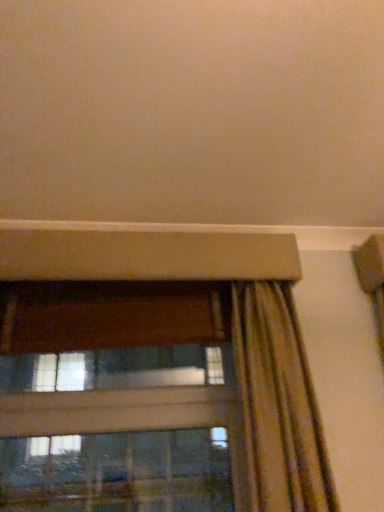
Question: From the image's perspective, is striped fabric curtain at lower right over transparent glass window at lower left?

Choices:
 (A) no
 (B) yes

Answer: (B)

Question: Is striped fabric curtain at lower right completely or partially outside of transparent glass window at lower left?

Choices:
 (A) yes
 (B) no

Answer: (A)

Question: Is striped fabric curtain at lower right oriented away from transparent glass window at lower left?

Choices:
 (A) no
 (B) yes

Answer: (A)

Question: Considering the relative sizes of striped fabric curtain at lower right and transparent glass window at lower left in the image provided, is striped fabric curtain at lower right wider than transparent glass window at lower left?

Choices:
 (A) no
 (B) yes

Answer: (B)

Question: From a real-world perspective, is striped fabric curtain at lower right below transparent glass window at lower left?

Choices:
 (A) yes
 (B) no

Answer: (B)

Question: Could you tell me if striped fabric curtain at lower right is facing transparent glass window at lower left?

Choices:
 (A) no
 (B) yes

Answer: (A)

Question: Considering the relative sizes of transparent glass window at lower left and striped fabric curtain at lower right in the image provided, is transparent glass window at lower left shorter than striped fabric curtain at lower right?

Choices:
 (A) yes
 (B) no

Answer: (A)

Question: Is transparent glass window at lower left placed right next to striped fabric curtain at lower right?

Choices:
 (A) no
 (B) yes

Answer: (A)

Question: From a real-world perspective, is transparent glass window at lower left located beneath striped fabric curtain at lower right?

Choices:
 (A) no
 (B) yes

Answer: (B)

Question: Does transparent glass window at lower left have a greater height compared to striped fabric curtain at lower right?

Choices:
 (A) yes
 (B) no

Answer: (B)

Question: Is transparent glass window at lower left positioned in front of striped fabric curtain at lower right?

Choices:
 (A) yes
 (B) no

Answer: (B)

Question: Can you confirm if transparent glass window at lower left is positioned to the left of striped fabric curtain at lower right?

Choices:
 (A) yes
 (B) no

Answer: (A)

Question: Relative to transparent glass window at lower left, is striped fabric curtain at lower right in front or behind?

Choices:
 (A) behind
 (B) front

Answer: (B)